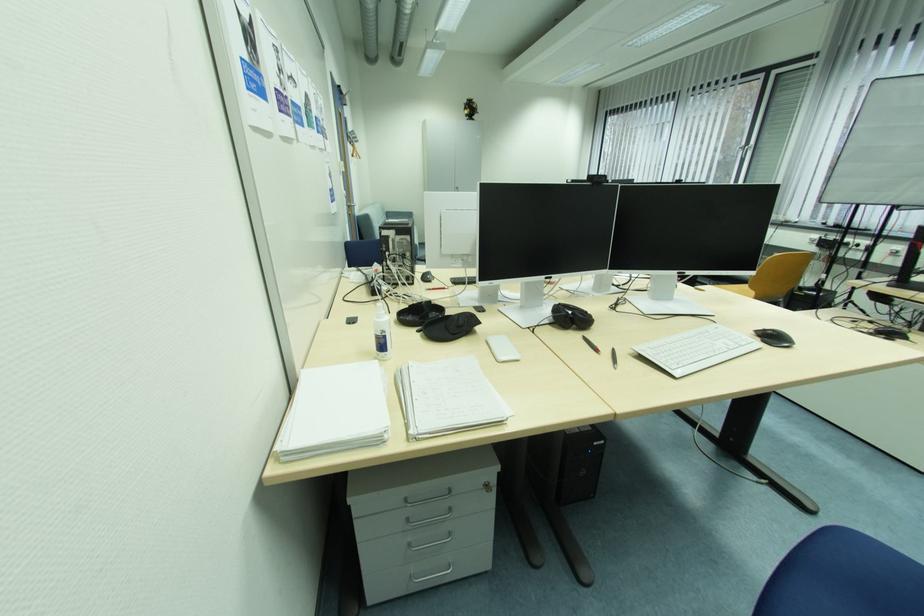
Find where to click the black computer mouse. Please return your answer as a coordinate pair (x, y).

(774, 338)